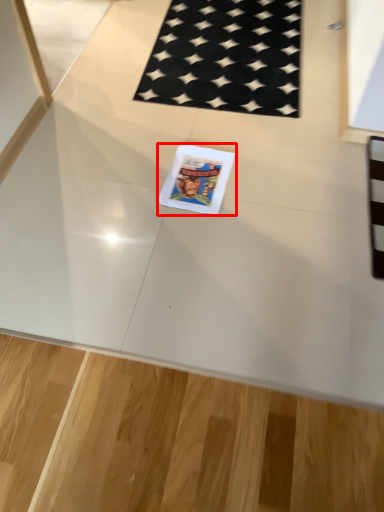
Question: From the image's perspective, what is the correct spatial relationship of comic book (annotated by the red box) in relation to mat?

Choices:
 (A) above
 (B) below

Answer: (B)